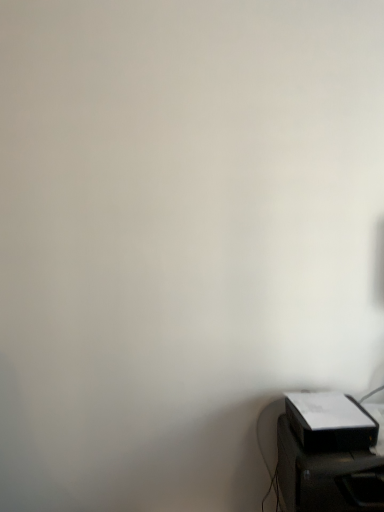
Question: From the image's perspective, is white matte printer at lower right located beneath black plastic printer at lower right?

Choices:
 (A) yes
 (B) no

Answer: (B)

Question: Considering the relative sizes of white matte printer at lower right and black plastic printer at lower right in the image provided, is white matte printer at lower right smaller than black plastic printer at lower right?

Choices:
 (A) yes
 (B) no

Answer: (A)

Question: Is white matte printer at lower right not near black plastic printer at lower right?

Choices:
 (A) yes
 (B) no

Answer: (B)

Question: Is white matte printer at lower right to the left of black plastic printer at lower right from the viewer's perspective?

Choices:
 (A) no
 (B) yes

Answer: (B)

Question: Considering the relative positions of white matte printer at lower right and black plastic printer at lower right in the image provided, is white matte printer at lower right to the right of black plastic printer at lower right from the viewer's perspective?

Choices:
 (A) no
 (B) yes

Answer: (A)

Question: Is white matte printer at lower right completely or partially outside of black plastic printer at lower right?

Choices:
 (A) no
 (B) yes

Answer: (B)

Question: From the image's perspective, is black plastic printer at lower right over white matte printer at lower right?

Choices:
 (A) no
 (B) yes

Answer: (A)

Question: From a real-world perspective, is black plastic printer at lower right on top of white matte printer at lower right?

Choices:
 (A) no
 (B) yes

Answer: (A)

Question: Is black plastic printer at lower right closer to the viewer compared to white matte printer at lower right?

Choices:
 (A) no
 (B) yes

Answer: (B)

Question: Does black plastic printer at lower right have a larger size compared to white matte printer at lower right?

Choices:
 (A) yes
 (B) no

Answer: (A)

Question: Can you confirm if black plastic printer at lower right is taller than white matte printer at lower right?

Choices:
 (A) yes
 (B) no

Answer: (A)

Question: Is black plastic printer at lower right not close to white matte printer at lower right?

Choices:
 (A) yes
 (B) no

Answer: (B)

Question: Is point (317, 443) closer or farther from the camera than point (327, 467)?

Choices:
 (A) farther
 (B) closer

Answer: (A)